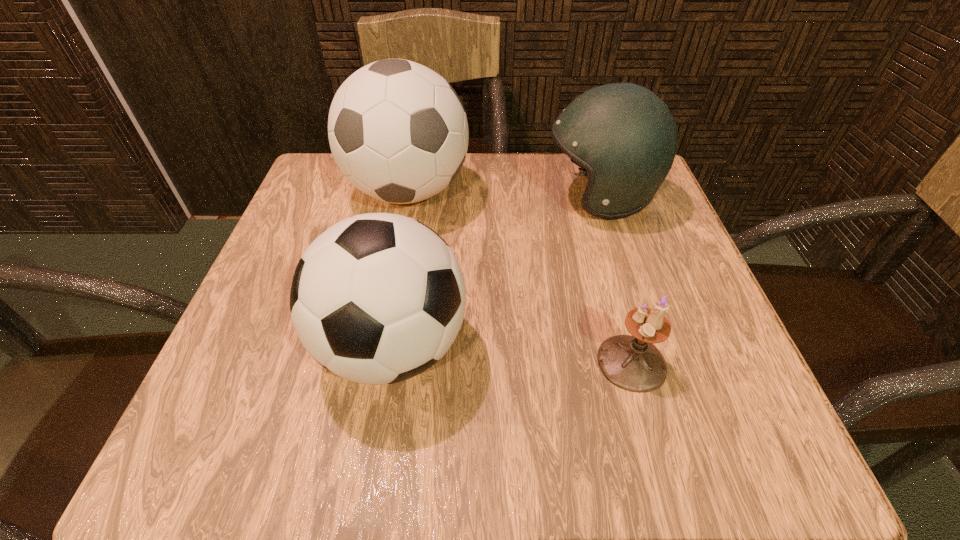
Locate an element on the screen. soccer ball positioned at the far edge is located at coordinates coord(398,131).

The width and height of the screenshot is (960, 540). In order to click on football helmet that is at the far edge in this screenshot , I will do `click(622, 134)`.

This screenshot has width=960, height=540. In order to click on object that is at the near edge in this screenshot , I will do `click(378, 298)`.

Where is `football helmet present at the right edge`? Image resolution: width=960 pixels, height=540 pixels. football helmet present at the right edge is located at coordinates (622, 134).

This screenshot has height=540, width=960. I want to click on candle holder that is at the right edge, so click(x=633, y=363).

The height and width of the screenshot is (540, 960). In order to click on object positioned at the far left corner in this screenshot , I will do `click(398, 131)`.

This screenshot has width=960, height=540. Find the location of `object that is at the near left corner`. object that is at the near left corner is located at coordinates 378,298.

This screenshot has width=960, height=540. What are the coordinates of `object located at the far right corner` in the screenshot? It's located at (622, 134).

The image size is (960, 540). Identify the location of free spot at the far edge of the desktop. (394, 211).

Locate an element on the screen. The width and height of the screenshot is (960, 540). blank space at the near edge of the desktop is located at coordinates (550, 453).